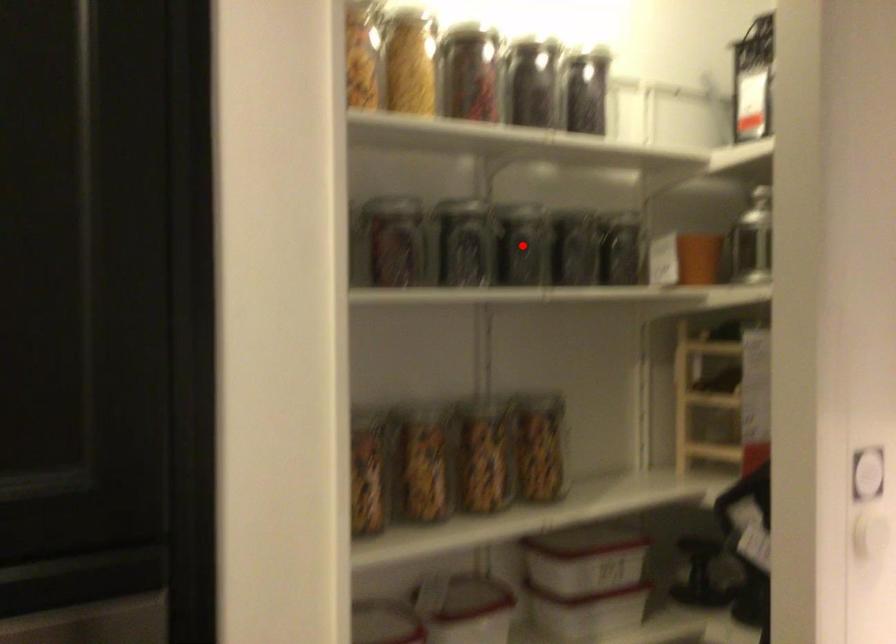
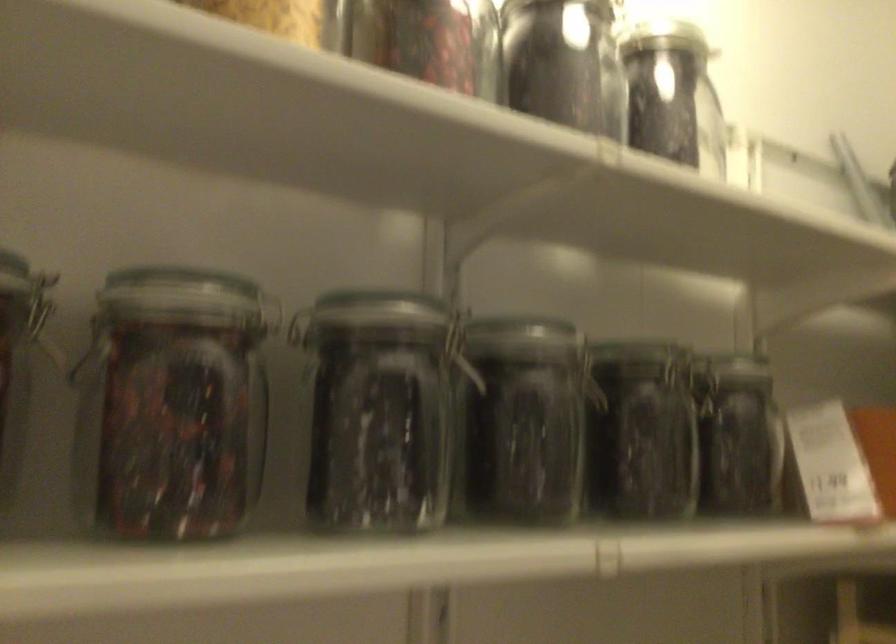
Where in the second image is the point corresponding to the highlighted location from the first image?

(524, 420)